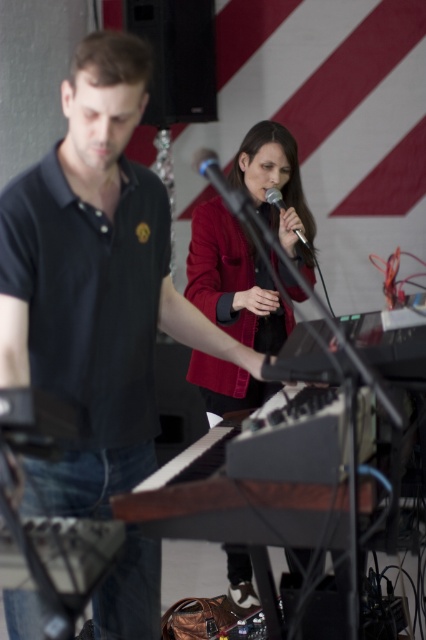
Question: Which point is farther to the camera?

Choices:
 (A) (227, 205)
 (B) (123, 564)

Answer: (A)

Question: Does matte red jacket at center appear under metallic blue microphone at center?

Choices:
 (A) no
 (B) yes

Answer: (B)

Question: From the image, what is the correct spatial relationship of black matte shirt at left in relation to matte red jacket at center?

Choices:
 (A) below
 (B) above

Answer: (A)

Question: Based on their relative distances, which object is nearer to the silver metallic microphone at center?

Choices:
 (A) black matte shirt at left
 (B) matte red jacket at center
 (C) metallic blue microphone at center

Answer: (C)

Question: Observing the image, what is the correct spatial positioning of matte red jacket at center in reference to silver metallic microphone at center?

Choices:
 (A) below
 (B) above

Answer: (A)

Question: Which object is closer to the camera taking this photo?

Choices:
 (A) matte red jacket at center
 (B) silver metallic microphone at center

Answer: (A)